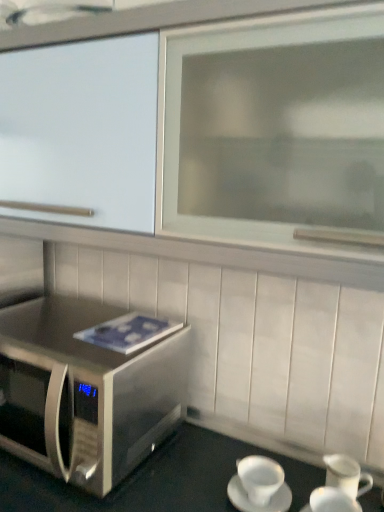
Question: Is white ceramic coffee cup at lower right, which is counted as the 2th coffee cup, starting from the left, surrounded by stainless steel microwave at lower left?

Choices:
 (A) yes
 (B) no

Answer: (A)

Question: Does stainless steel microwave at lower left turn towards white ceramic coffee cup at lower right, which is counted as the 2th coffee cup, starting from the left?

Choices:
 (A) yes
 (B) no

Answer: (B)

Question: Can you see stainless steel microwave at lower left touching white ceramic coffee cup at lower right, which appears as the 1th coffee cup when viewed from the right?

Choices:
 (A) no
 (B) yes

Answer: (A)

Question: From the image's perspective, does stainless steel microwave at lower left appear lower than white ceramic coffee cup at lower right, which appears as the 1th coffee cup when viewed from the right?

Choices:
 (A) yes
 (B) no

Answer: (A)

Question: Is stainless steel microwave at lower left to the left of white ceramic coffee cup at lower right, which is counted as the 2th coffee cup, starting from the left, from the viewer's perspective?

Choices:
 (A) yes
 (B) no

Answer: (A)

Question: Is stainless steel microwave at lower left shorter than white ceramic coffee cup at lower right, which appears as the 1th coffee cup when viewed from the right?

Choices:
 (A) no
 (B) yes

Answer: (A)

Question: Considering the relative positions of white ceramic coffee cup at lower right, which is counted as the 2th coffee cup, starting from the left, and stainless steel microwave at lower left in the image provided, is white ceramic coffee cup at lower right, which is counted as the 2th coffee cup, starting from the left, to the left of stainless steel microwave at lower left from the viewer's perspective?

Choices:
 (A) yes
 (B) no

Answer: (B)

Question: From the image's perspective, does white ceramic coffee cup at lower right, which is counted as the 2th coffee cup, starting from the left, appear lower than stainless steel microwave at lower left?

Choices:
 (A) no
 (B) yes

Answer: (A)

Question: Can you confirm if white ceramic coffee cup at lower right, which is counted as the 2th coffee cup, starting from the left, is smaller than stainless steel microwave at lower left?

Choices:
 (A) no
 (B) yes

Answer: (B)

Question: Is white ceramic coffee cup at lower right, which is counted as the 2th coffee cup, starting from the left, oriented away from stainless steel microwave at lower left?

Choices:
 (A) yes
 (B) no

Answer: (B)

Question: From a real-world perspective, is white ceramic coffee cup at lower right, which is counted as the 2th coffee cup, starting from the left, located higher than stainless steel microwave at lower left?

Choices:
 (A) no
 (B) yes

Answer: (B)

Question: Is white ceramic coffee cup at lower right, which is counted as the 2th coffee cup, starting from the left, directly adjacent to stainless steel microwave at lower left?

Choices:
 (A) yes
 (B) no

Answer: (B)

Question: From a real-world perspective, is stainless steel microwave at lower left under stainless steel microwave oven at lower left?

Choices:
 (A) no
 (B) yes

Answer: (B)